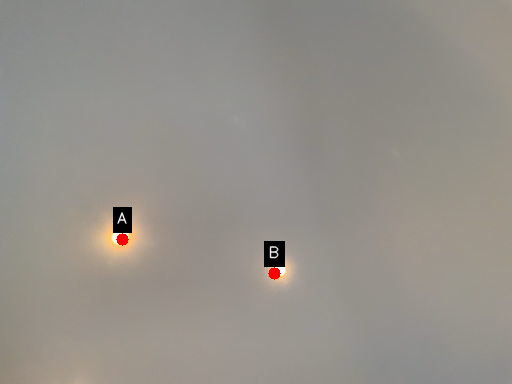
Question: Two points are circled on the image, labeled by A and B beside each circle. Which point is farther from the camera taking this photo?

Choices:
 (A) A is further
 (B) B is further

Answer: (B)